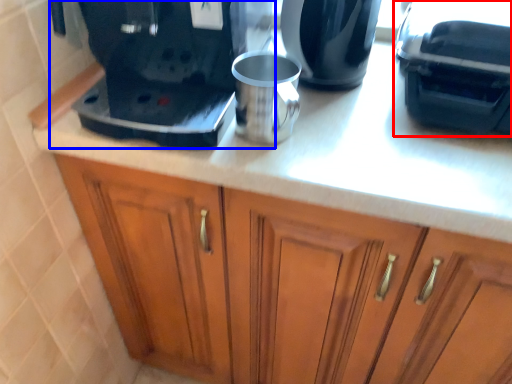
Question: Which object is closer to the camera taking this photo, coffee machine (highlighted by a red box) or home appliance (highlighted by a blue box)?

Choices:
 (A) coffee machine
 (B) home appliance

Answer: (B)